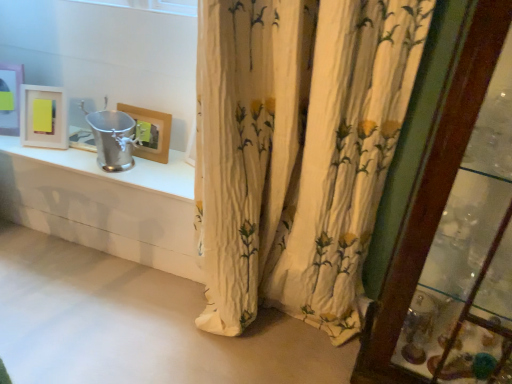
The width and height of the screenshot is (512, 384). What are the coordinates of `vacant region below white floral fabric curtain at center (from a real-world perspective)` in the screenshot? It's located at (272, 335).